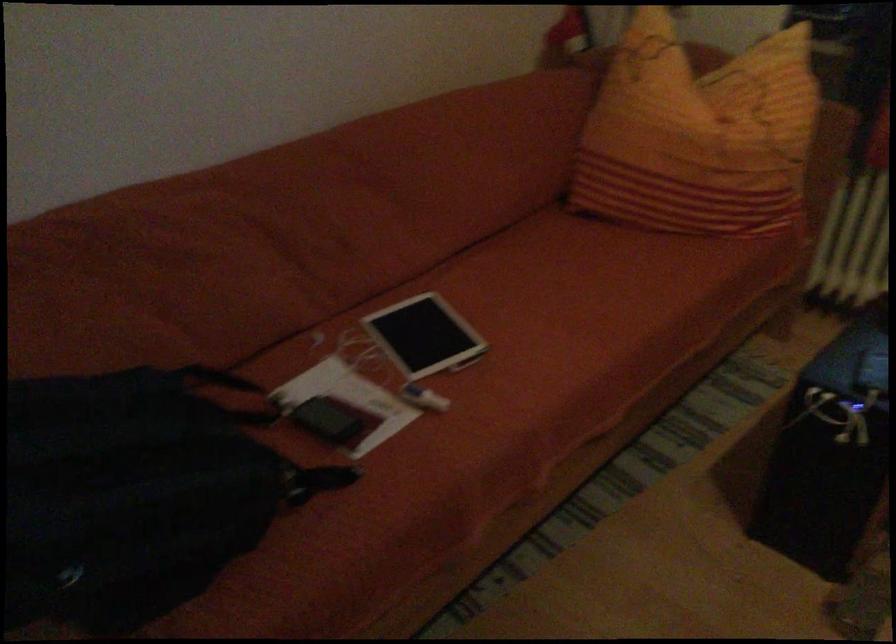
The image size is (896, 644). Describe the element at coordinates (228, 381) in the screenshot. I see `the black bag strap` at that location.